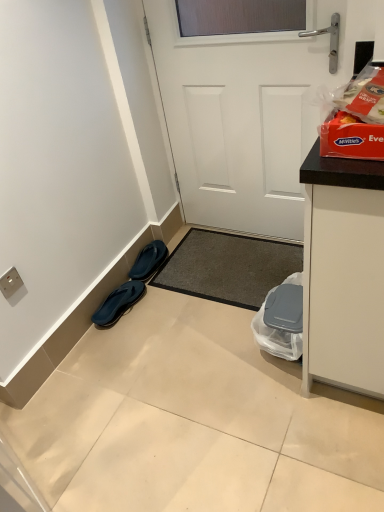
At what (x,y) coordinates should I click in order to perform the action: click on free spot in front of black rubber flip-flops at lower left, which appears as the 1th footwear when ordered from the bottom. Please return your answer as a coordinate pair (x, y). Looking at the image, I should click on (119, 344).